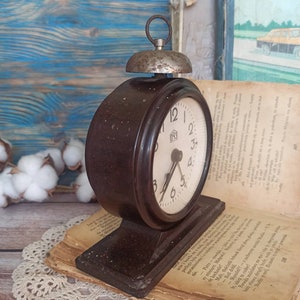
The width and height of the screenshot is (300, 300). Find the location of `clock`. clock is located at coordinates (175, 152).